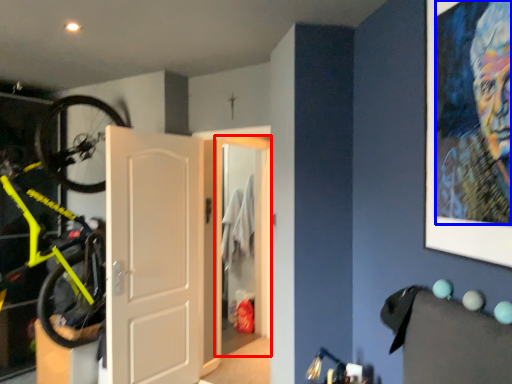
Question: Which of the following is the closest to the observer, door (highlighted by a red box) or person (highlighted by a blue box)?

Choices:
 (A) door
 (B) person

Answer: (B)